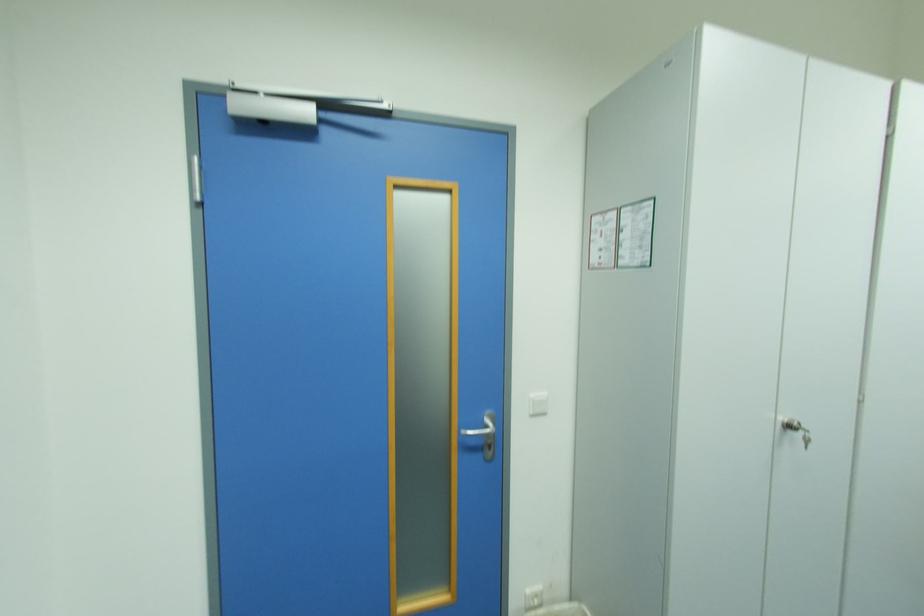
Where would you plugging in the white power outlet? Please return your answer as a coordinate pair (x, y).

(532, 597)